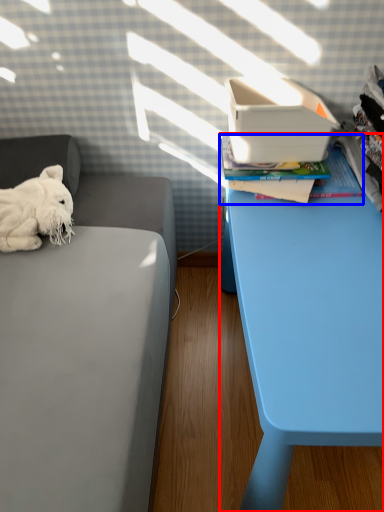
Question: Which of the following is the farthest to the observer, table (highlighted by a red box) or paperback book (highlighted by a blue box)?

Choices:
 (A) table
 (B) paperback book

Answer: (B)